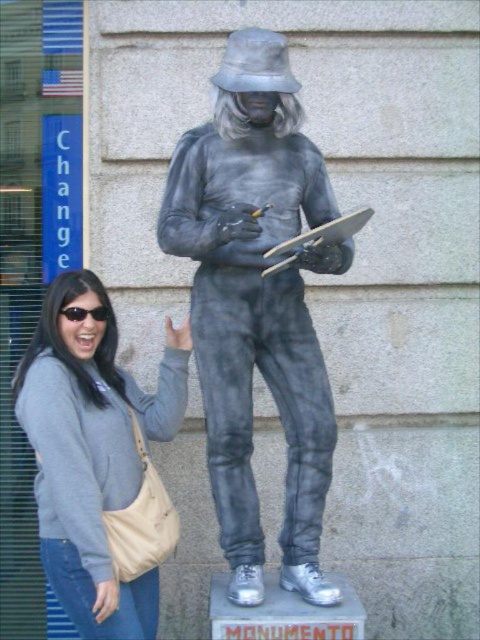
Question: Which point is farther to the camera?

Choices:
 (A) (324, 449)
 (B) (82, 513)

Answer: (A)

Question: Can you confirm if gray metallic figure at center is positioned below gray fabric sweatshirt at left?

Choices:
 (A) no
 (B) yes

Answer: (A)

Question: Is gray metallic figure at center below gray fabric sweatshirt at left?

Choices:
 (A) yes
 (B) no

Answer: (B)

Question: Which point is farther to the camera?

Choices:
 (A) gray metallic figure at center
 (B) gray fabric sweatshirt at left

Answer: (B)

Question: Is gray metallic figure at center bigger than gray fabric sweatshirt at left?

Choices:
 (A) yes
 (B) no

Answer: (B)